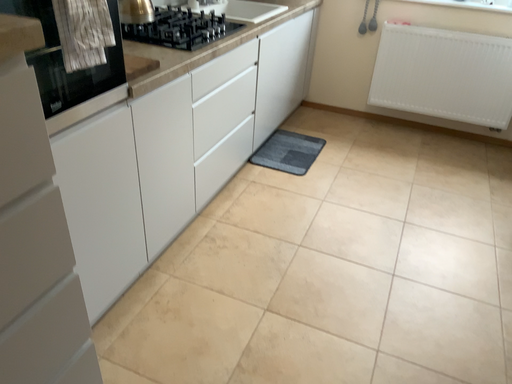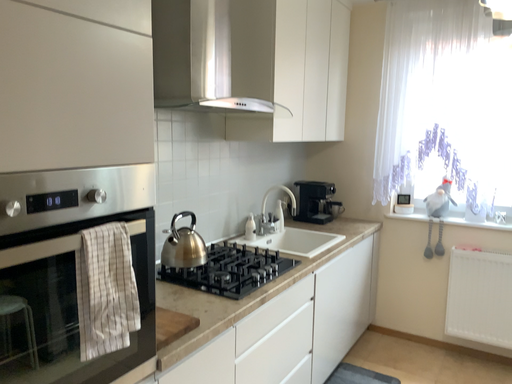
Question: How did the camera likely rotate when shooting the video?

Choices:
 (A) rotated upward
 (B) rotated downward

Answer: (A)